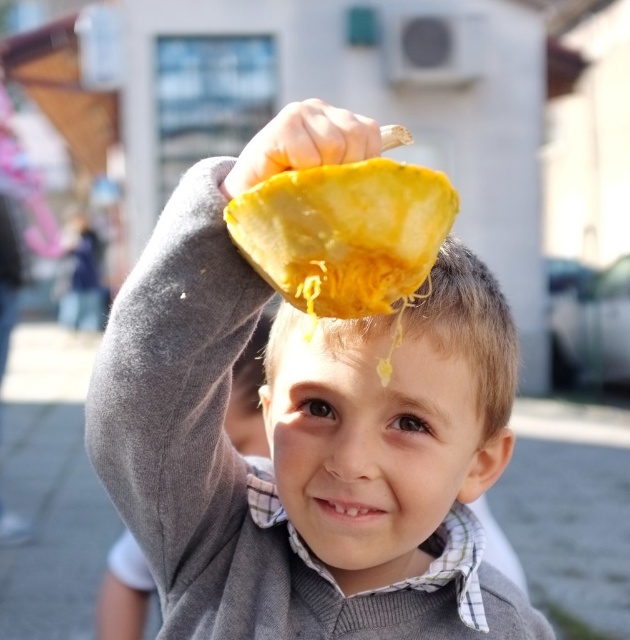
You are a delivery person who needs to place both pumpkins in a box that can only hold items up to 1 meter in height. Given that the yellow matte pumpkin at upper center is taller than the yellow soft pumpkin at center, can both fit vertically in the box?

The yellow soft pumpkin at center is shorter than the yellow matte pumpkin at upper center. Since the box can hold up to 1 meter, both can fit vertically as long as the tallest one, the yellow matte pumpkin at upper center, is under 1 meter.

Looking at the scene, where is the yellow soft pumpkin at center in relation to the yellow matte pumpkin at upper center?

The yellow soft pumpkin at center is to the left of the yellow matte pumpkin at upper center.

You are standing in front of the yellow matte pumpkin at upper center. If you want to place a 24 inch tall decoration on a shelf behind it, will the decoration be visible from your current position?

The yellow matte pumpkin at upper center is 26.21 inches from viewer. Since the decoration is 24 inches tall, it will be visible as it is shorter than the distance to the pumpkin.